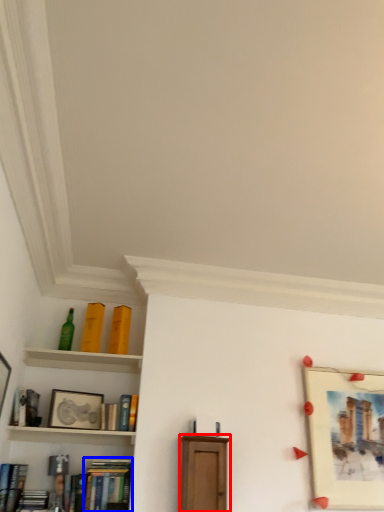
Question: Which object is closer to the camera taking this photo, furniture (highlighted by a red box) or book (highlighted by a blue box)?

Choices:
 (A) furniture
 (B) book

Answer: (A)